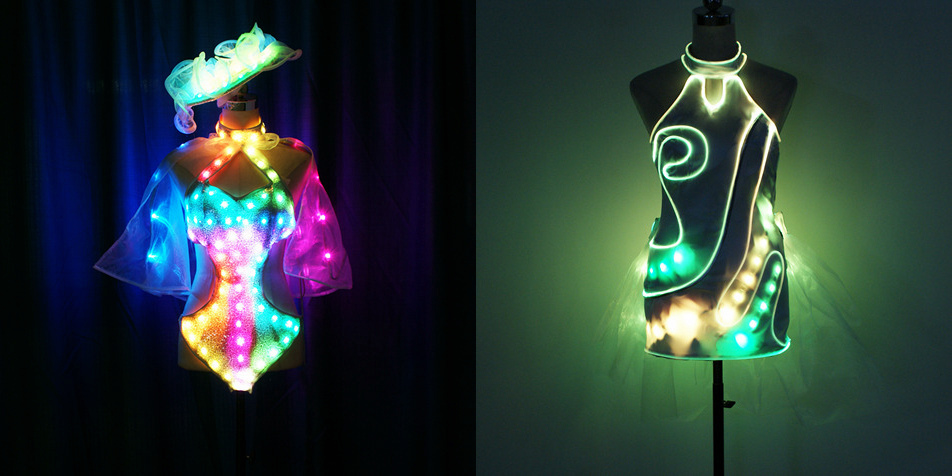
This screenshot has height=476, width=952. I want to click on wall, so click(571, 205).